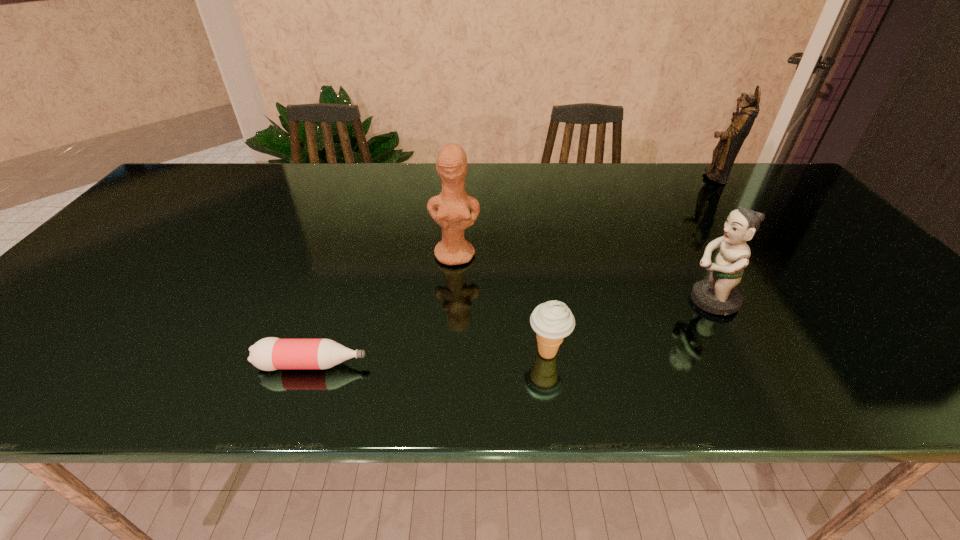
This screenshot has width=960, height=540. Find the location of `icecream at the near edge`. icecream at the near edge is located at coordinates (552, 321).

Locate an element on the screen. The image size is (960, 540). bottle that is at the near edge is located at coordinates (271, 353).

The height and width of the screenshot is (540, 960). What are the coordinates of `vacant space at the far edge` in the screenshot? It's located at (299, 170).

Locate an element on the screen. The width and height of the screenshot is (960, 540). free space at the near edge of the desktop is located at coordinates (503, 380).

Locate an element on the screen. vacant space at the left edge of the desktop is located at coordinates (117, 249).

Where is `vacant point at the right edge`? The height and width of the screenshot is (540, 960). vacant point at the right edge is located at coordinates (781, 221).

The width and height of the screenshot is (960, 540). In order to click on vacant space at the far right corner of the desktop in this screenshot , I will do `click(759, 176)`.

Where is `free space between the second nearest figurine and the third shortest object`? free space between the second nearest figurine and the third shortest object is located at coordinates (583, 278).

Locate an element on the screen. This screenshot has width=960, height=540. vacant space that's between the leftmost object and the leftmost figurine is located at coordinates (384, 310).

Find the location of a particular element. free spot between the leftmost figurine and the nearest figurine is located at coordinates (583, 278).